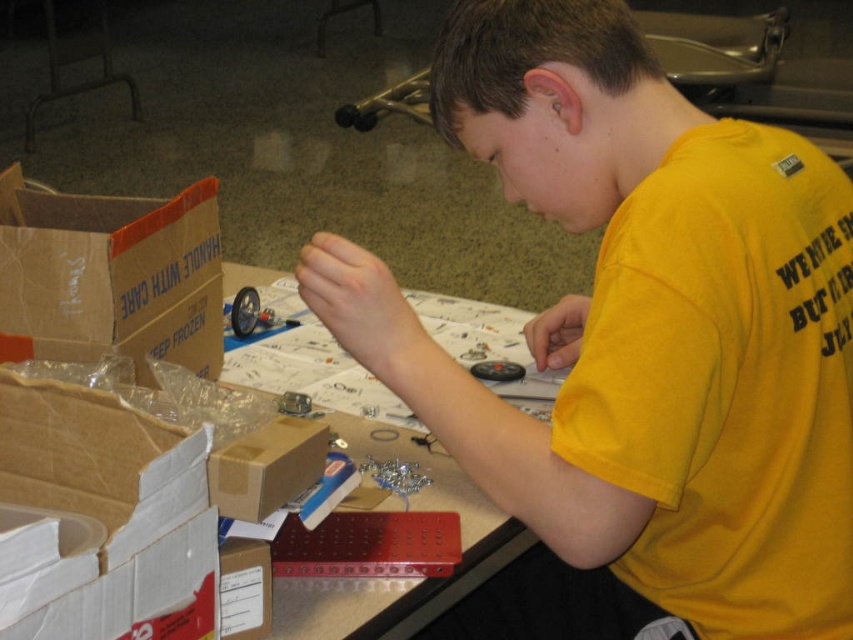
Does brown cardboard box at left have a larger size compared to white paper at center?

Incorrect, brown cardboard box at left is not larger than white paper at center.

Is point (165, 316) positioned after point (381, 620)?

Yes.

Find the location of a particular element. brown cardboard box at left is located at coordinates tap(109, 276).

Locate an element on the screen. Image resolution: width=853 pixels, height=640 pixels. brown cardboard box at left is located at coordinates (109, 276).

The height and width of the screenshot is (640, 853). Describe the element at coordinates (109, 276) in the screenshot. I see `brown cardboard box at left` at that location.

Is point (120, 323) in front of point (247, 316)?

Yes, point (120, 323) is closer to viewer.

What are the coordinates of `brown cardboard box at left` in the screenshot? It's located at (109, 276).

Can you confirm if yellow matte shirt at center is positioned above brown cardboard box at left?

No.

Can you confirm if yellow matte shirt at center is shorter than brown cardboard box at left?

In fact, yellow matte shirt at center may be taller than brown cardboard box at left.

Where is `yellow matte shirt at center`? The image size is (853, 640). yellow matte shirt at center is located at coordinates (637, 344).

This screenshot has height=640, width=853. In order to click on yellow matte shirt at center in this screenshot , I will do `click(637, 344)`.